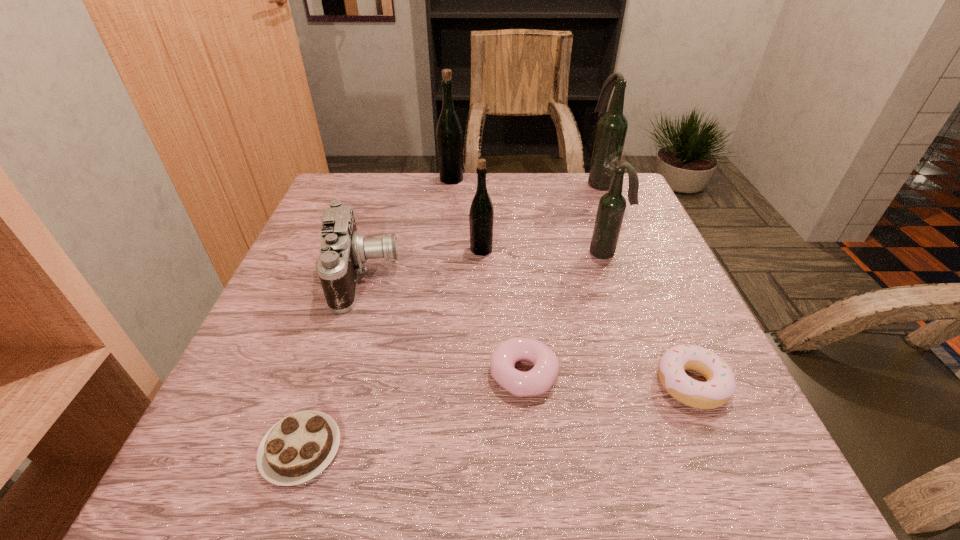
Where is `chocolate cake present at the left edge`? chocolate cake present at the left edge is located at coordinates (296, 449).

I want to click on doughnut that is at the right edge, so click(x=720, y=386).

Find the location of a particular element. The height and width of the screenshot is (540, 960). object that is at the near left corner is located at coordinates (296, 449).

What are the coordinates of `object at the far right corner` in the screenshot? It's located at (612, 127).

The height and width of the screenshot is (540, 960). What are the coordinates of `free space at the far edge` in the screenshot? It's located at (535, 174).

In the image, there is a desktop. Where is `vacant space at the near edge`? The image size is (960, 540). vacant space at the near edge is located at coordinates (651, 452).

The width and height of the screenshot is (960, 540). In order to click on vacant region at the left edge of the desktop in this screenshot , I will do `click(364, 235)`.

The image size is (960, 540). In order to click on free spot at the right edge of the desktop in this screenshot , I will do `click(673, 292)`.

This screenshot has height=540, width=960. Find the location of `vacant space at the far left corner`. vacant space at the far left corner is located at coordinates (337, 184).

Find the location of a particular element. free region at the far right corner of the desktop is located at coordinates (625, 180).